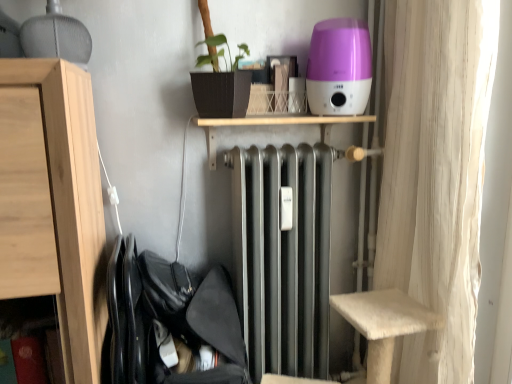
Question: Relative to white textured curtain at right, is metallic silver radiator at center in front or behind?

Choices:
 (A) front
 (B) behind

Answer: (B)

Question: From the image's perspective, relative to white textured curtain at right, is metallic silver radiator at center above or below?

Choices:
 (A) above
 (B) below

Answer: (A)

Question: Which is farther from the black fabric laundry at lower left?

Choices:
 (A) metallic silver radiator at center
 (B) white textured curtain at right
 (C) light wood cabinet at left
 (D) purple glossy humidifier at upper center

Answer: (D)

Question: Which of these objects is positioned farthest from the light wood cabinet at left?

Choices:
 (A) white textured curtain at right
 (B) metallic silver radiator at center
 (C) black fabric laundry at lower left
 (D) purple glossy humidifier at upper center

Answer: (A)